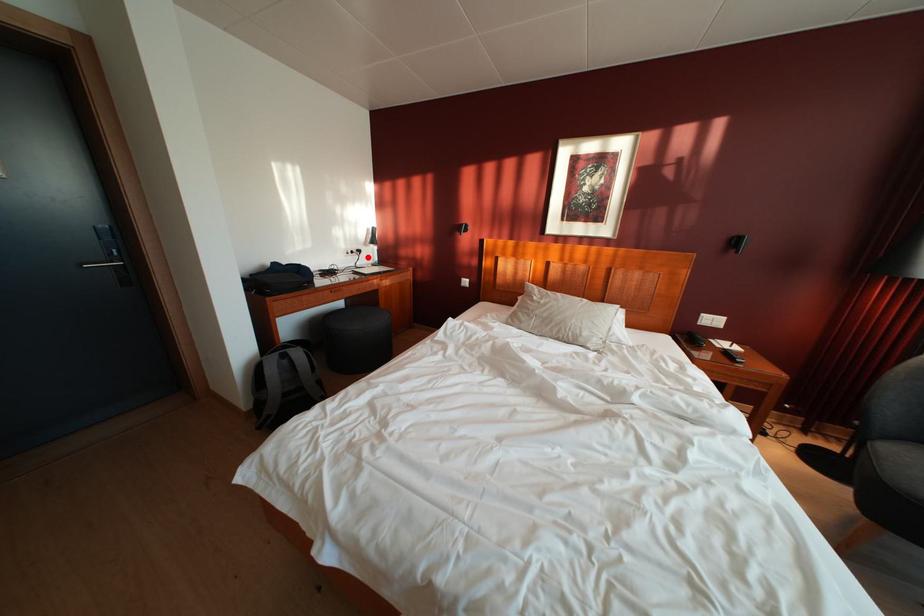
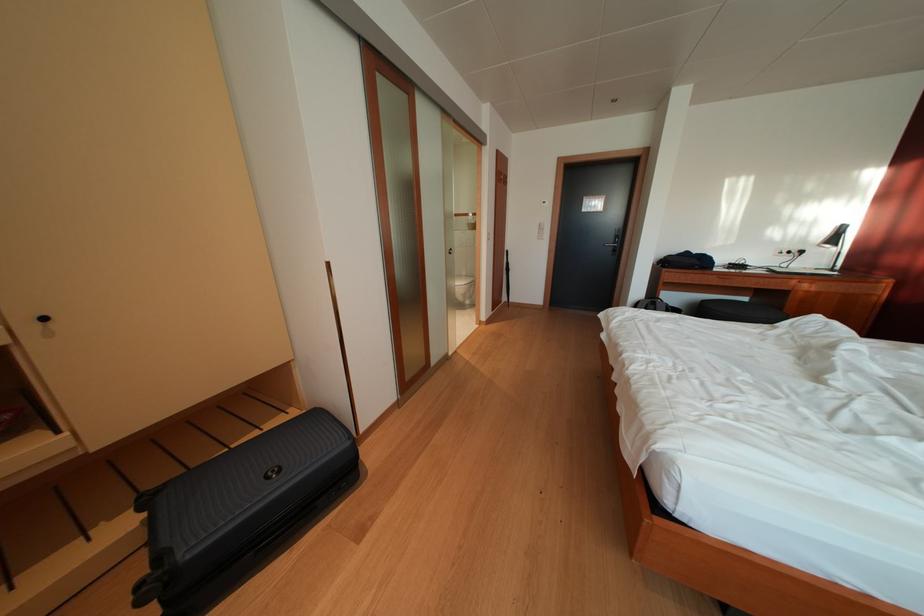
Where in the second image is the point corresponding to the highlighted location from the first image?

(809, 257)